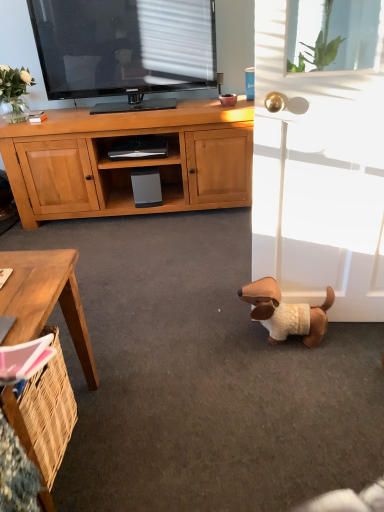
Locate an element on the screen. The width and height of the screenshot is (384, 512). vacant area that lies between white matte screen door at lower right and brown wooden desk at lower left is located at coordinates (201, 386).